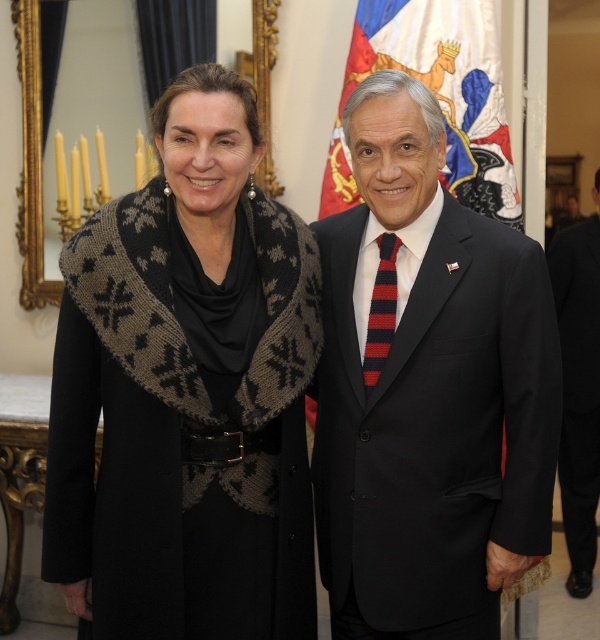
What do you see at coordinates (187, 392) in the screenshot? I see `black knitted scarf at left` at bounding box center [187, 392].

The image size is (600, 640). I want to click on black knitted scarf at left, so click(187, 392).

You are a GUI agent. You are given a task and a screenshot of the screen. Output one action in this format:
    pyautogui.click(x=<x>, y=<y>)
    Task: Click on the black knitted scarf at left
    The image size is (600, 640).
    Given the screenshot: What is the action you would take?
    pyautogui.click(x=187, y=392)

The height and width of the screenshot is (640, 600). I want to click on black wool suit at right, so click(x=579, y=387).

Between black wool suit at right and red knitted tie at center, which one appears on the left side from the viewer's perspective?

Positioned to the left is red knitted tie at center.

The image size is (600, 640). I want to click on black wool suit at right, so click(579, 387).

You are a GUI agent. You are given a task and a screenshot of the screen. Output one action in this format:
    pyautogui.click(x=<x>, y=<y>)
    Task: Click on the black wool suit at right
    The width and height of the screenshot is (600, 640).
    Given the screenshot: What is the action you would take?
    pyautogui.click(x=579, y=387)

Which is above, black wool suit at center or silk flag at upper center?

silk flag at upper center is higher up.

Does point (394, 634) come in front of point (457, 179)?

Yes.

Find the location of `black wool suit at center`. black wool suit at center is located at coordinates (429, 392).